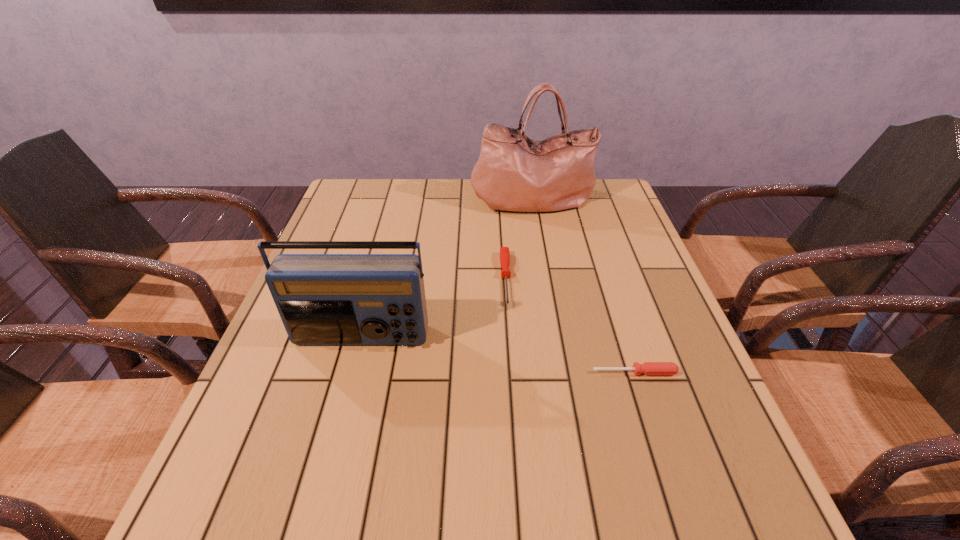
Find the location of `vacant space located at the tip of the farther screwdriver`. vacant space located at the tip of the farther screwdriver is located at coordinates (513, 376).

Identify the location of vacant region located on the back of the right screwdriver. Image resolution: width=960 pixels, height=540 pixels. [x=595, y=251].

Image resolution: width=960 pixels, height=540 pixels. What are the coordinates of `object that is positioned at the far edge` in the screenshot? It's located at (514, 173).

The image size is (960, 540). Find the location of `object that is at the left edge`. object that is at the left edge is located at coordinates (323, 299).

Identify the location of handbag located in the right edge section of the desktop. (514, 173).

Find the location of a particular element. This screenshot has width=960, height=540. screwdriver that is positioned at the right edge is located at coordinates (648, 368).

You are a GUI agent. You are given a task and a screenshot of the screen. Output one action in this format:
    pyautogui.click(x=<x>, y=<y>)
    Task: Click on the object at the far right corner
    Image resolution: width=960 pixels, height=540 pixels.
    Given the screenshot: What is the action you would take?
    pyautogui.click(x=514, y=173)

Find the location of a particular element. This screenshot has width=960, height=540. vacant position at the far edge of the desktop is located at coordinates (398, 215).

Where is `vacant position at the near edge of the desktop`? The height and width of the screenshot is (540, 960). vacant position at the near edge of the desktop is located at coordinates (338, 539).

In the image, there is a desktop. Find the location of `vacant space at the left edge`. vacant space at the left edge is located at coordinates (273, 348).